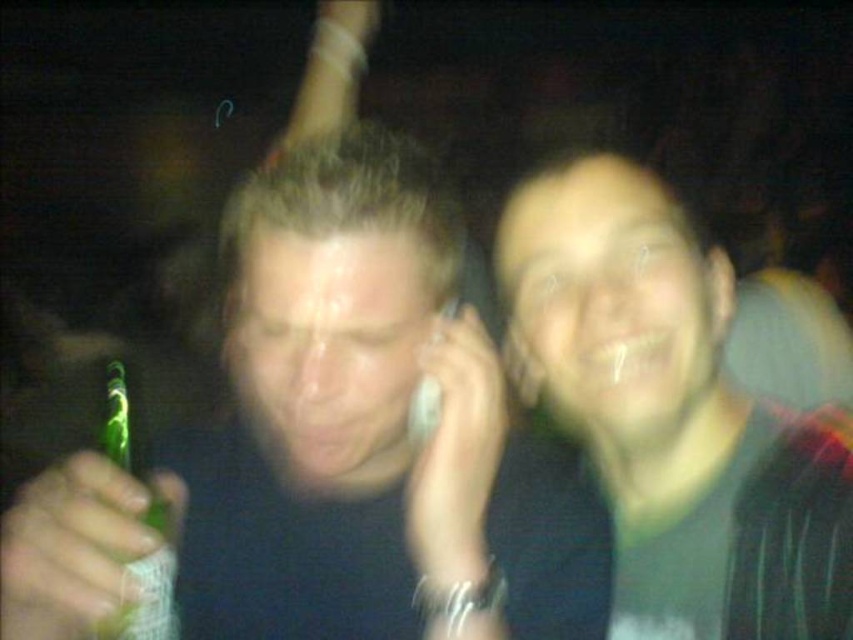
Question: Which point is farther to the camera?

Choices:
 (A) green matte beer can at right
 (B) green matte beer bottle at left

Answer: (A)

Question: In this image, where is green matte beer can at right located relative to green glass bottle at left?

Choices:
 (A) below
 (B) above

Answer: (B)

Question: Can you confirm if green matte beer bottle at left is positioned to the right of green glass bottle at left?

Choices:
 (A) no
 (B) yes

Answer: (B)

Question: Can you confirm if green matte beer can at right is wider than green glass bottle at left?

Choices:
 (A) no
 (B) yes

Answer: (B)

Question: Which object appears closest to the camera in this image?

Choices:
 (A) green matte beer can at right
 (B) green matte beer bottle at left

Answer: (B)

Question: Among these points, which one is farthest from the camera?

Choices:
 (A) (844, 573)
 (B) (126, 451)

Answer: (B)